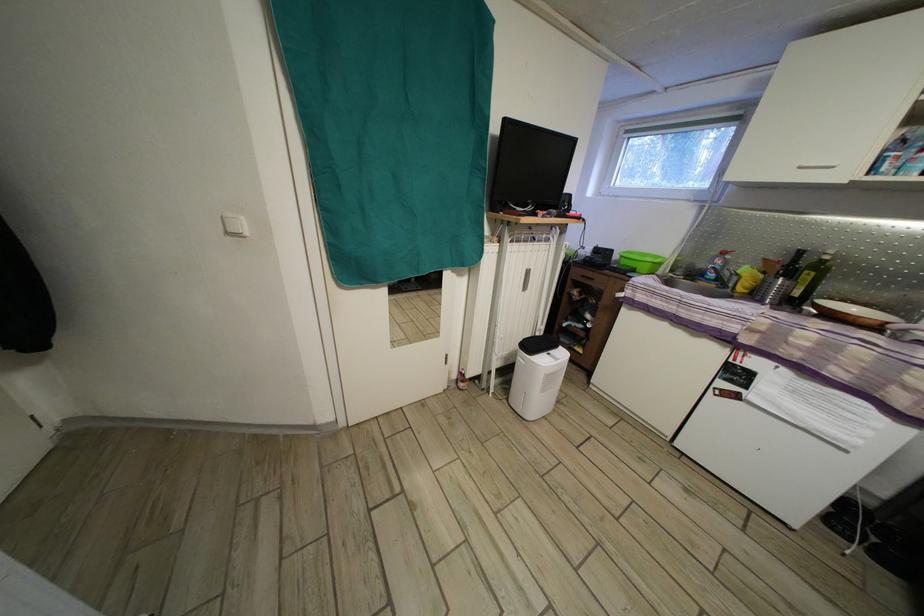
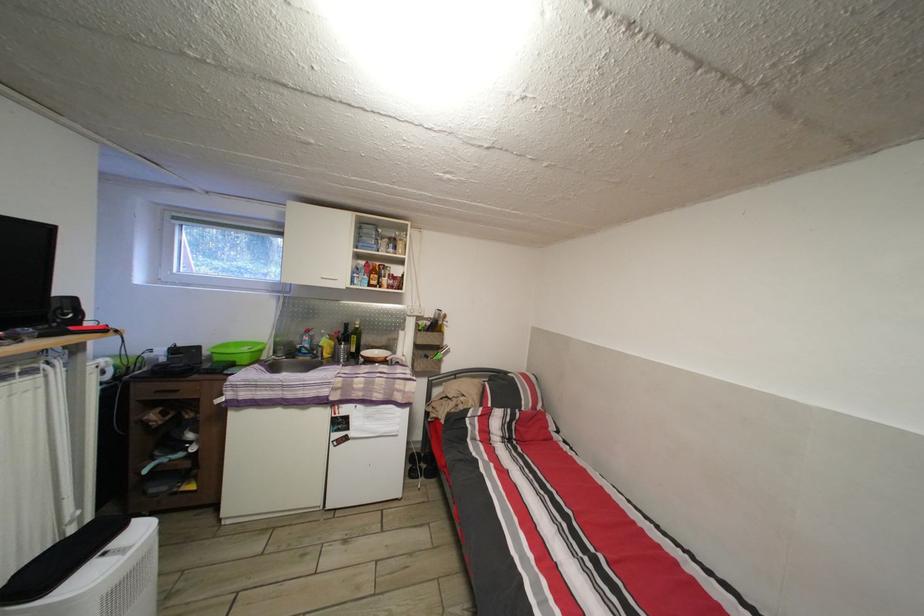
The point at (x=622, y=262) is marked in the first image. Where is the corresponding point in the second image?

(213, 359)